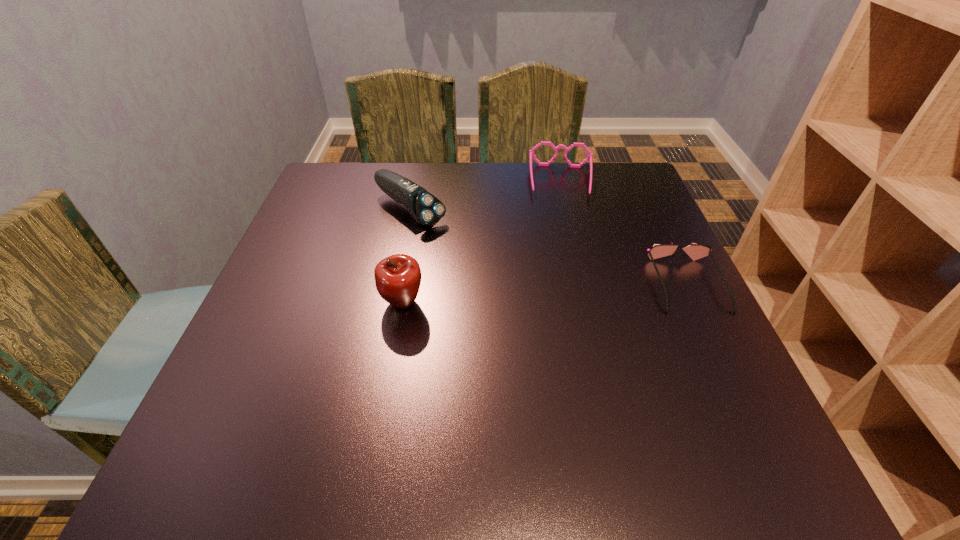
Identify the location of apple. (398, 277).

Locate an element on the screen. Image resolution: width=960 pixels, height=540 pixels. sunglasses is located at coordinates [695, 251].

You are a GUI agent. You are given a task and a screenshot of the screen. Output one action in this format:
    pyautogui.click(x=<x>, y=<y>)
    Task: Click on the rightmost object
    
    Given the screenshot: What is the action you would take?
    pyautogui.click(x=695, y=251)

You are a GUI agent. You are given a task and a screenshot of the screen. Output one action in this format:
    pyautogui.click(x=<x>, y=<y>)
    Task: Click on the electric shaver
    
    Given the screenshot: What is the action you would take?
    pyautogui.click(x=426, y=209)

You are a GUI agent. You are given a task and a screenshot of the screen. Output one action in this format:
    pyautogui.click(x=<x>, y=<y>)
    Task: Click on the third tallest object
    This screenshot has width=960, height=540.
    Given the screenshot: What is the action you would take?
    pyautogui.click(x=531, y=152)

Find the location of a particular element. The height and width of the screenshot is (540, 960). spectacles is located at coordinates (531, 152).

Find the location of a particular element. The height and width of the screenshot is (540, 960). vacant space located 0.170m on the back of the tallest object is located at coordinates (414, 237).

This screenshot has height=540, width=960. I want to click on vacant space located on the bridge of the shortest object, so click(721, 355).

Where is `vacant space located 0.120m on the head of the electric shaver`? The image size is (960, 540). vacant space located 0.120m on the head of the electric shaver is located at coordinates (467, 250).

Identify the location of vacant area situated 0.180m on the head of the electric shaver. This screenshot has width=960, height=540. (485, 263).